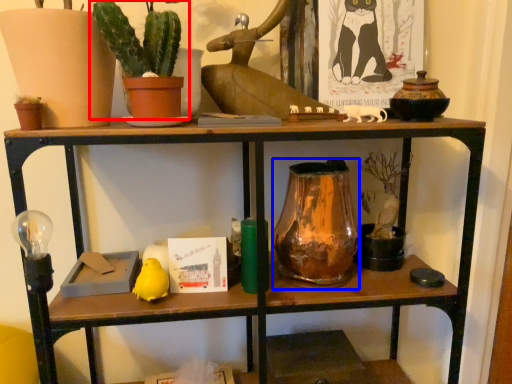
Question: Which of the following is the farthest to the observer, houseplant (highlighted by a red box) or glass vase (highlighted by a blue box)?

Choices:
 (A) houseplant
 (B) glass vase

Answer: (B)